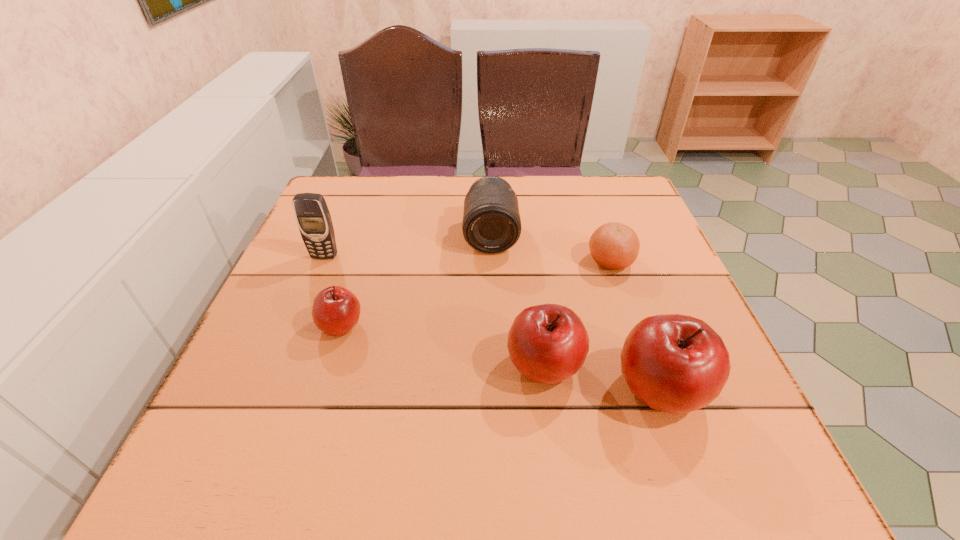
Please determine a free point for an extra apple to ensure balance. Please provide its 2D coordinates. Your answer should be formatted as a tuple, i.e. [(x, y)], where the tuple contains the x and y coordinates of a point satisfying the conditions above.

[(439, 345)]